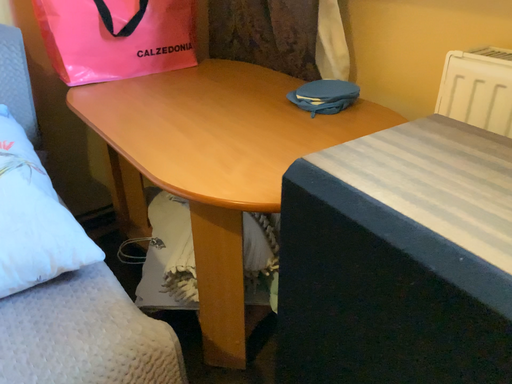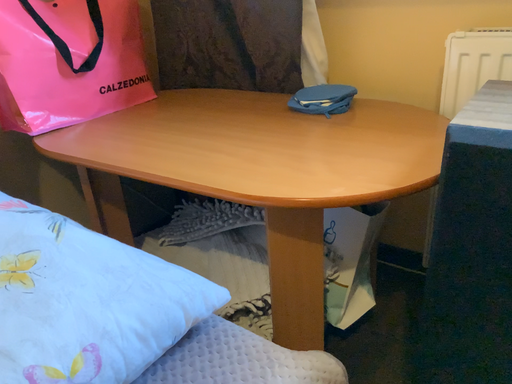
Question: Which way did the camera rotate in the video?

Choices:
 (A) rotated downward
 (B) rotated upward

Answer: (B)